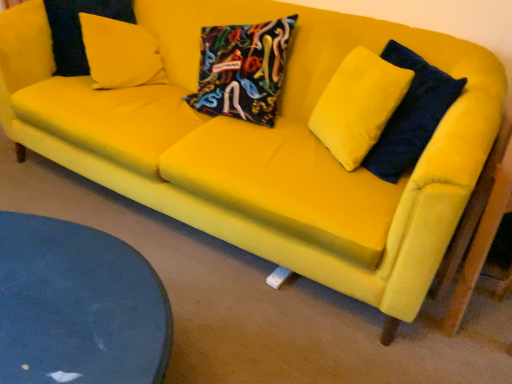
Identify the location of vacant location below wooden side table at right (from a real-world perspective). (485, 312).